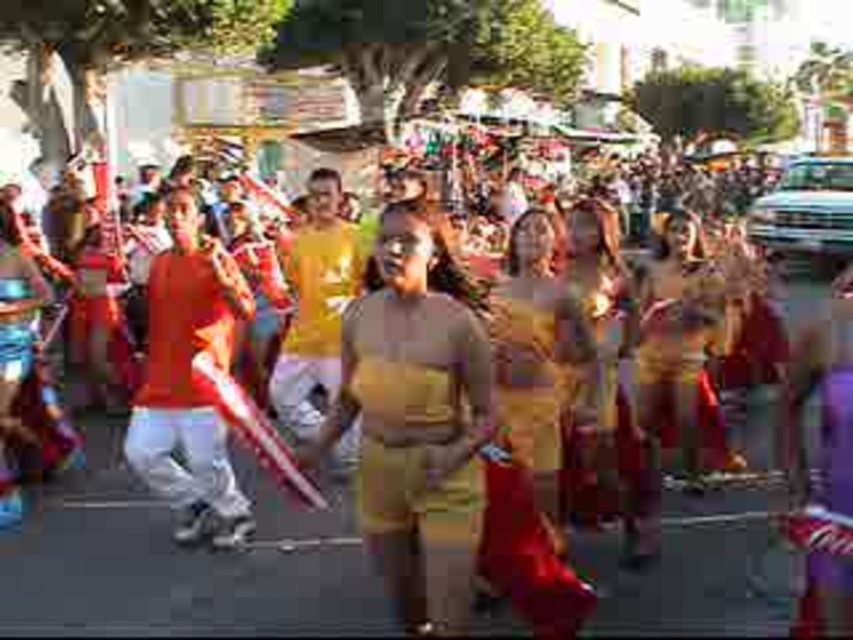
You are a photographer standing in the crowd watching the parade. You want to take a photo of both the matte gold skirt at center and the purple matte dress at center. Which one will appear larger in your photo?

The matte gold skirt at center will appear larger in the photo because it is closer to the viewer than the purple matte dress at center.

You are a photographer at the parade and want to capture both the matte gold dress at center and the matte yellow dress at center in a single photo. Which dress should you focus on first to ensure both are in frame?

The matte gold dress at center is not as tall as the matte yellow dress at center, so focus on the taller matte yellow dress at center first to ensure both are in frame.

You are a photographer at the event and want to capture both the matte gold skirt at center and the purple matte dress at center in a single frame. Which object should you focus on first to ensure both are in the frame?

The matte gold skirt at center is larger in size than the purple matte dress at center, so you should focus on the matte gold skirt at center first to ensure both are in the frame.